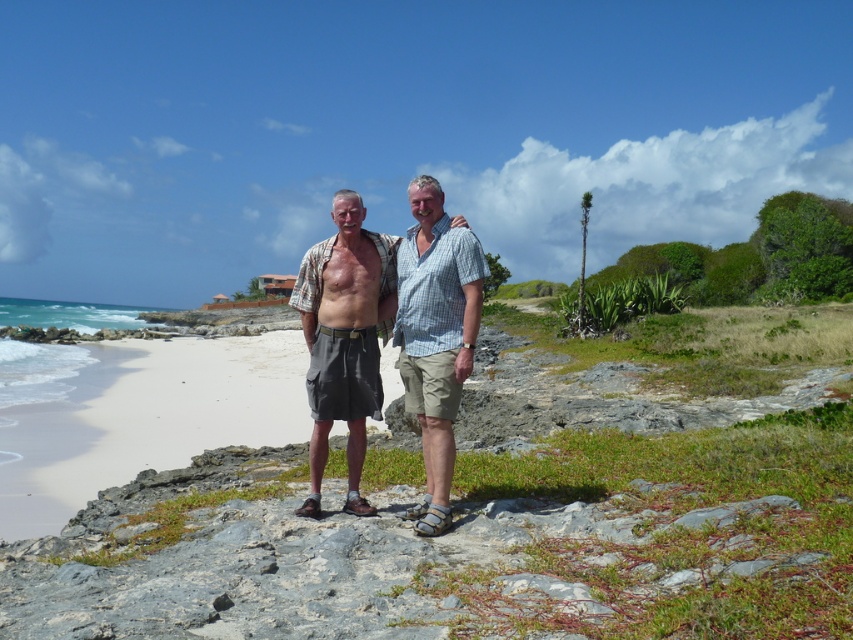
You are a photographer trying to capture a shot of the white sand beach at center and the matte khaki shorts at center. Based on their positions, which object would appear lower in the photo?

The white sand beach at center is located below the matte khaki shorts at center, so it would appear lower in the photo.